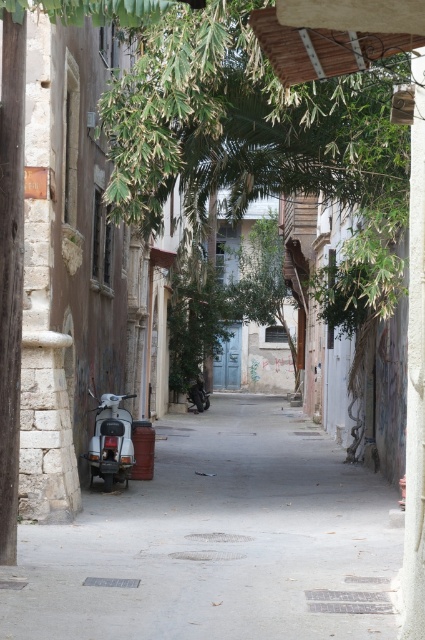
You are navigating a delivery robot through the narrow alleyway. The robot requires a clear path 1 meter wide to pass safely. The scooter is parked at coordinates mentioned. Can the robot maneuver around the white matte scooter at lower left without obstruction?

The white matte scooter at lower left is located at point (110, 442). Since the alley is narrow, but the scooter is positioned at a specific coordinate, the robot can likely maneuver around it as long as there is sufficient space between the scooter and the walls. However, without exact measurements of the alley width, it is uncertain if the 1 meter clearance is maintained. The scooter itself does not block the entire path, so the robot might navigate around it depending on the exact layout.

You are a delivery person trying to navigate through the narrow alleyway. You see two scooters, the white matte scooter at left and the white matte scooter at lower left. Which scooter should you avoid to ensure your delivery vehicle can pass through the alley safely?

The white matte scooter at left might be wider than white matte scooter at lower left, so you should avoid the white matte scooter at left to ensure your delivery vehicle can pass through the alley safely.

You are a delivery person needing to navigate through the narrow alleyway. You see the white matte scooter at left and the shiny black motorcycle at center. Which vehicle is positioned closer to the entrance of the building?

The white matte scooter at left is positioned closer to the entrance of the building because it is to the right of the shiny black motorcycle at center, which places it nearer to the building entrance on the left side of the alley.